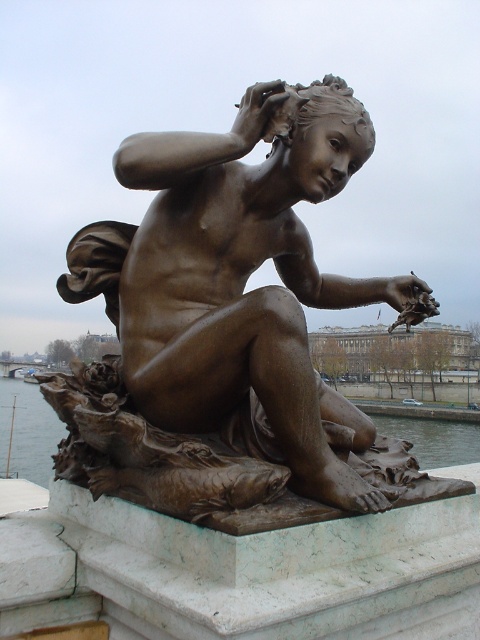
You are an art student analyzing the sculpture and its surroundings. Based on the scene, which object has a smaller width between the bronze statue at center and the clear water at statue center?

The bronze statue at center has a lesser width compared to the clear water at statue center.

You are standing in front of the bronze statue at center and want to take a photo of it. If your camera can focus on objects up to 3 meters away, will you be able to take a clear photo?

The bronze statue at center is 3.47 meters from viewer, which is beyond the camera focus range of 3 meters. Therefore, you won let take a clear photo.

You are standing at the origin point in the coordinate system of the image. Where is the bronze statue at center located?

The bronze statue at center is located at point coordinates of (231,326).